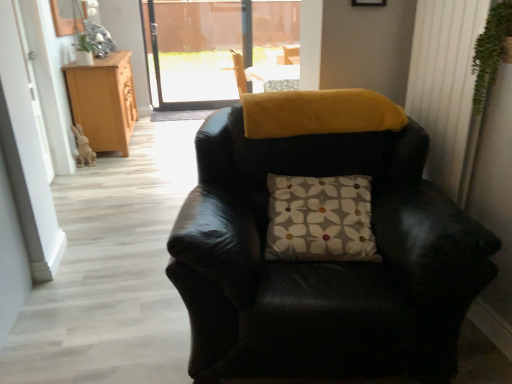
Question: Considering the relative sizes of black leather chair at center and light brown wood cabinet at left in the image provided, is black leather chair at center smaller than light brown wood cabinet at left?

Choices:
 (A) no
 (B) yes

Answer: (A)

Question: Can you see black leather chair at center touching light brown wood cabinet at left?

Choices:
 (A) yes
 (B) no

Answer: (B)

Question: Can you confirm if black leather chair at center is positioned to the right of light brown wood cabinet at left?

Choices:
 (A) no
 (B) yes

Answer: (B)

Question: Is black leather chair at center far away from light brown wood cabinet at left?

Choices:
 (A) yes
 (B) no

Answer: (A)

Question: Is black leather chair at center outside of light brown wood cabinet at left?

Choices:
 (A) yes
 (B) no

Answer: (A)

Question: Is floral-patterned fabric pillow at center bigger or smaller than white textured curtain at right?

Choices:
 (A) big
 (B) small

Answer: (A)

Question: Is point (325, 256) positioned closer to the camera than point (426, 31)?

Choices:
 (A) farther
 (B) closer

Answer: (B)

Question: Is floral-patterned fabric pillow at center spatially inside white textured curtain at right, or outside of it?

Choices:
 (A) outside
 (B) inside

Answer: (A)

Question: In terms of width, does floral-patterned fabric pillow at center look wider or thinner when compared to white textured curtain at right?

Choices:
 (A) wide
 (B) thin

Answer: (A)

Question: From their relative heights in the image, would you say floral-patterned fabric pillow at center is taller or shorter than light brown wood cabinet at left?

Choices:
 (A) short
 (B) tall

Answer: (A)

Question: Looking at their shapes, would you say floral-patterned fabric pillow at center is wider or thinner than light brown wood cabinet at left?

Choices:
 (A) wide
 (B) thin

Answer: (B)

Question: Choose the correct answer: Is floral-patterned fabric pillow at center inside light brown wood cabinet at left or outside it?

Choices:
 (A) inside
 (B) outside

Answer: (B)

Question: Would you say floral-patterned fabric pillow at center is to the left or to the right of light brown wood cabinet at left in the picture?

Choices:
 (A) left
 (B) right

Answer: (B)

Question: Looking at the image, does white textured curtain at right seem bigger or smaller compared to green leafy plant at upper right?

Choices:
 (A) big
 (B) small

Answer: (A)

Question: In terms of height, does white textured curtain at right look taller or shorter compared to green leafy plant at upper right?

Choices:
 (A) tall
 (B) short

Answer: (A)